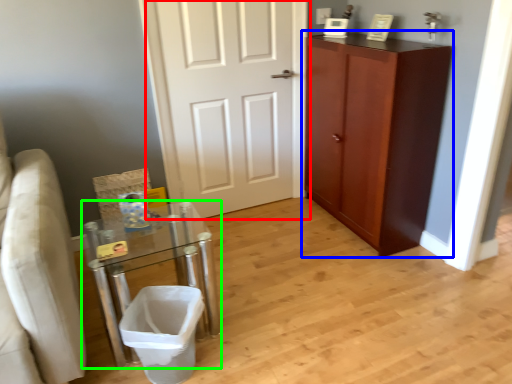
Question: Estimate the real-world distances between objects in this image. Which object is closer to door (highlighted by a red box), cabinetry (highlighted by a blue box) or table (highlighted by a green box)?

Choices:
 (A) cabinetry
 (B) table

Answer: (A)